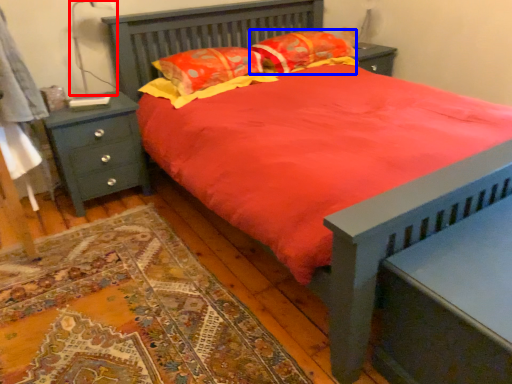
Question: Which object appears farthest to the camera in this image, table lamp (highlighted by a red box) or pillow (highlighted by a blue box)?

Choices:
 (A) table lamp
 (B) pillow

Answer: (B)